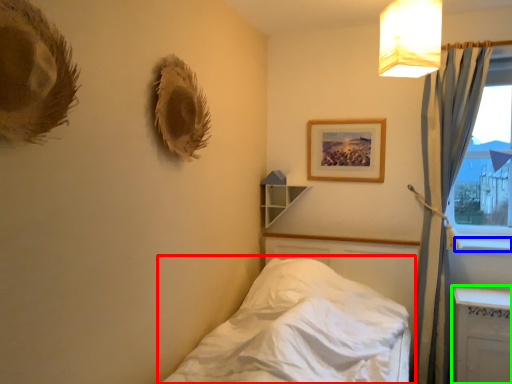
Question: Which object is positioned closest to bed (highlighted by a red box)? Select from window sill (highlighted by a blue box) and radiator (highlighted by a green box).

Choices:
 (A) window sill
 (B) radiator

Answer: (B)